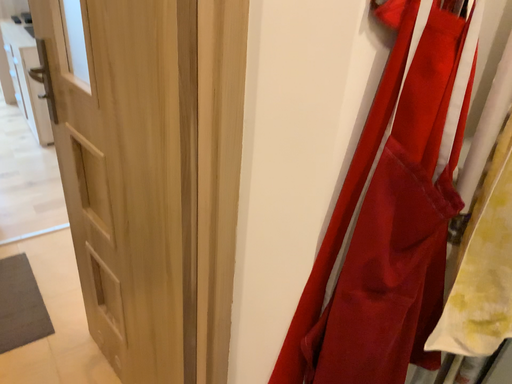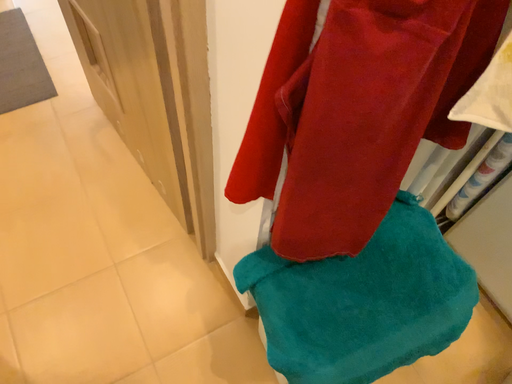
Question: How did the camera likely rotate when shooting the video?

Choices:
 (A) rotated downward
 (B) rotated upward

Answer: (A)